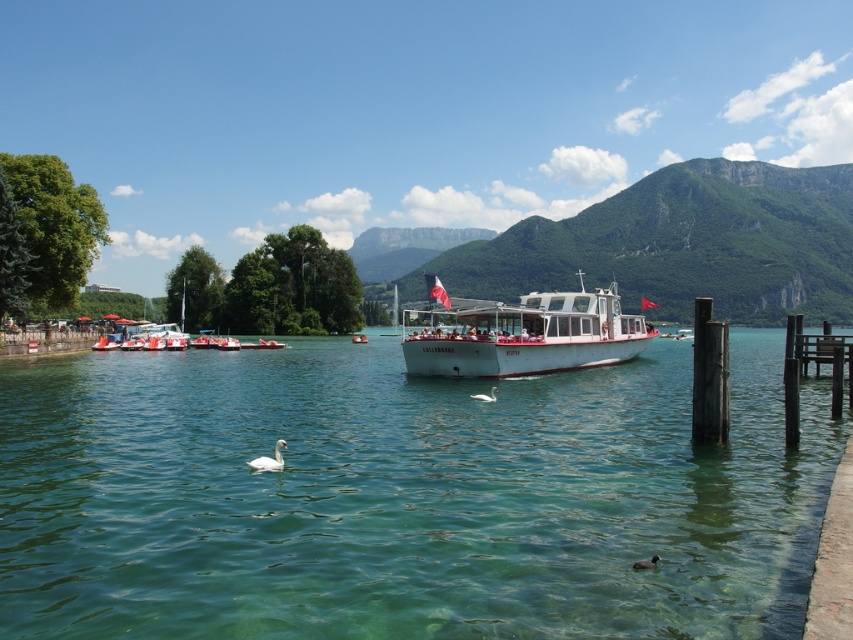
You are standing on the wooden dock at right and want to take a photo of the green rocky mountain at upper center. In which direction should you point your camera?

The green rocky mountain at upper center is to the right of the wooden dock at right, so you should point your camera to the left to capture it.

You are an observer standing on the lakeside. You see the clear water at center and the white matte boat at center. Which object is taller from your viewpoint?

The white matte boat at center is taller than the clear water at center.

You are a photographer planning to take a photo of the clear water at center and the white matte boat at center. Based on their positions, which object should you focus on first if you want to capture both in a single shot without moving the camera?

The clear water at center is located below the white matte boat at center, so you should focus on the white matte boat at center first since it is higher up and will be in the frame naturally when capturing the lower positioned clear water at center.